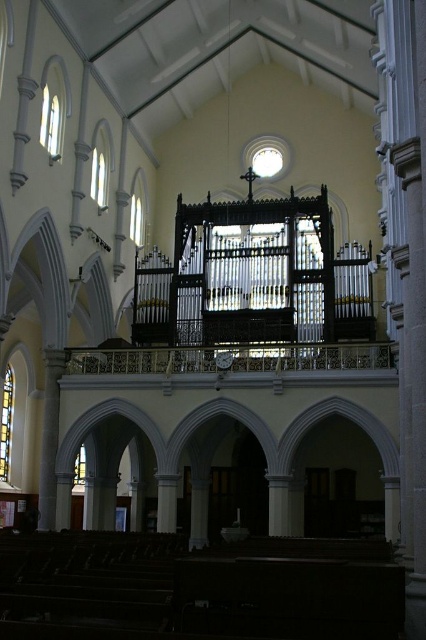
Question: Which point is farther to the camera?

Choices:
 (A) clear glass window at upper left
 (B) polished brass pipe organ at center

Answer: (A)

Question: Is polished brass pipe organ at center wider than stained glass window at left?

Choices:
 (A) yes
 (B) no

Answer: (A)

Question: Where is transparent glass window at upper left located in relation to stained glass window at left in the image?

Choices:
 (A) above
 (B) below

Answer: (A)

Question: Can you confirm if polished brass pipe organ at center is bigger than transparent stained glass at lower left?

Choices:
 (A) yes
 (B) no

Answer: (A)

Question: Which object is farther from the camera taking this photo?

Choices:
 (A) clear glass window at upper left
 (B) stained glass window at left

Answer: (B)

Question: Which object is farther from the camera taking this photo?

Choices:
 (A) transparent stained glass at lower left
 (B) stained glass window at left
 (C) clear glass window at upper left

Answer: (B)